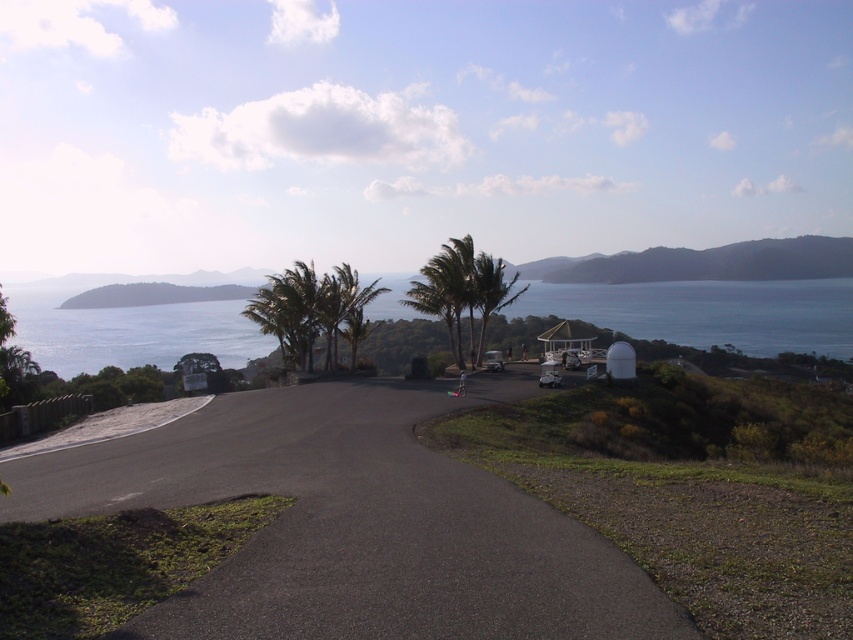
Question: Does blue water at center come in front of green leafy palm trees at center?

Choices:
 (A) no
 (B) yes

Answer: (A)

Question: Estimate the real-world distances between objects in this image. Which object is farther from the green leafy palm tree at center?

Choices:
 (A) blue water at center
 (B) black asphalt road at center
 (C) green leafy palm trees at center

Answer: (A)

Question: Which point is closer to the camera taking this photo?

Choices:
 (A) (309, 307)
 (B) (444, 278)
 (C) (601, 257)

Answer: (A)

Question: Does green matte hill at upper right appear over green leafy palm tree at center?

Choices:
 (A) yes
 (B) no

Answer: (A)

Question: Is blue water at center closer to the viewer compared to green matte hill at upper right?

Choices:
 (A) no
 (B) yes

Answer: (B)

Question: Considering the real-world distances, which object is closest to the blue water at center?

Choices:
 (A) black asphalt road at center
 (B) green leafy palm tree at center

Answer: (B)